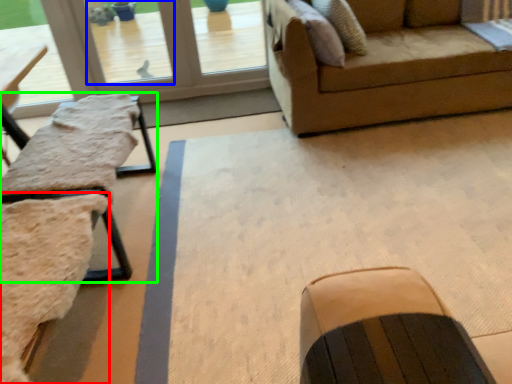
Question: Based on their relative distances, which object is nearer to swivel chair (highlighted by a red box)? Choose from window screen (highlighted by a blue box) and table (highlighted by a green box).

Choices:
 (A) window screen
 (B) table

Answer: (B)